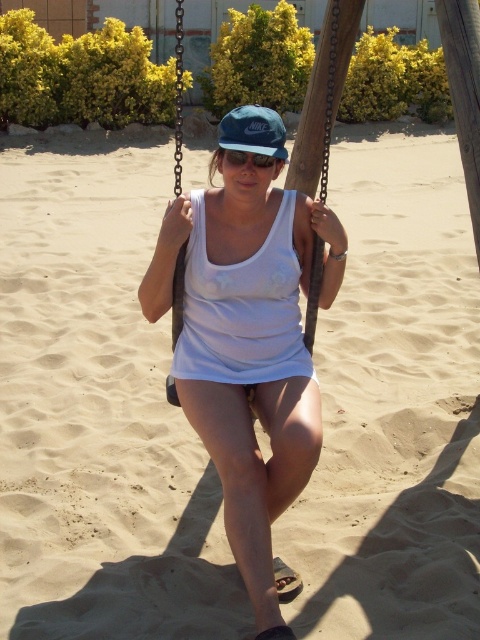
You are a photographer trying to capture the person in the swing. Since the white matte tank top at center and the matte black goggles at center are both at the center, which one will be more visible in your photo?

The white matte tank top at center is larger in size than the matte black goggles at center, so it will be more visible in the photo.

You are standing at the point with coordinates point (335, 12) and want to walk to the point with coordinates point (268, 148). According to the scene description, which direction should you move to reach your destination?

Since point (335, 12) is behind point (268, 148), you should move forward to reach your destination.